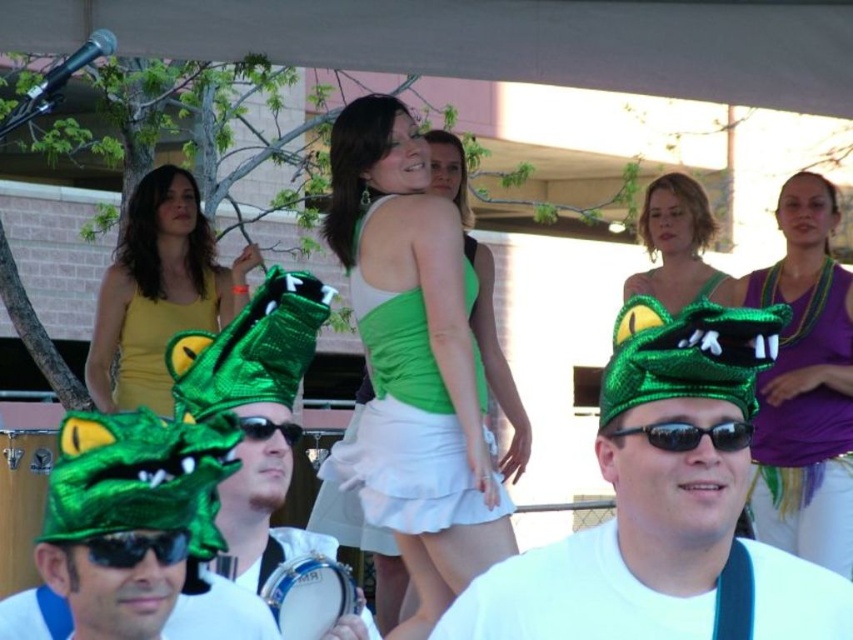
You are organizing a clothing display and need to know the width of the green satin tank top at center and the purple shiny tank top at upper right. Can you determine which one is wider?

The green satin tank top at center is wider than the purple shiny tank top at upper right according to the description.

You are taking a photo of the two points in the scene. Which point, point (824, 216) or point (724, 422), will appear larger in your photo?

Point (824, 216) is further to the camera than point (724, 422), so it will appear larger in the photo.